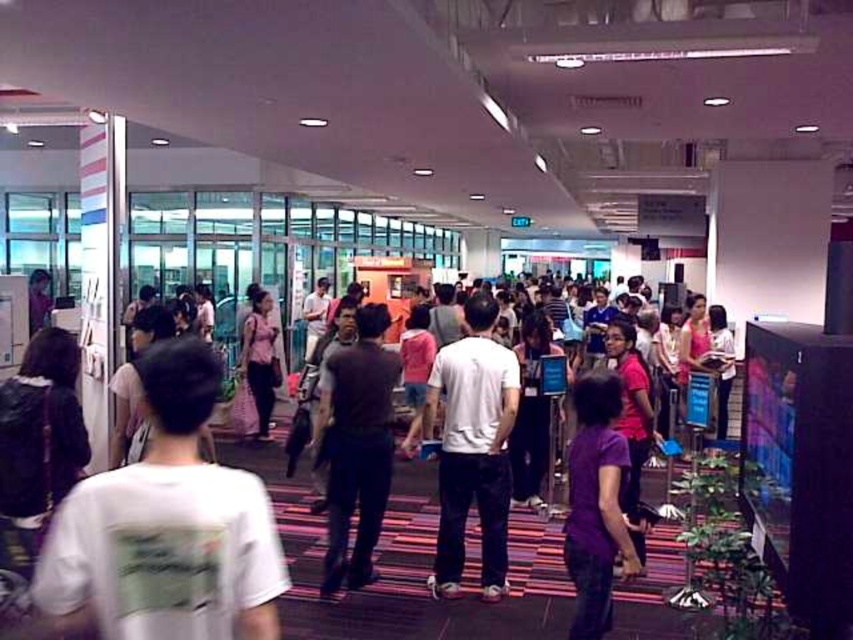
Question: Is white matte shirt at center wider than dark brown shirt at center?

Choices:
 (A) yes
 (B) no

Answer: (A)

Question: Which object is closer to the camera taking this photo?

Choices:
 (A) white cotton t-shirt at center
 (B) dark brown shirt at center
 (C) white matte shirt at center

Answer: (A)

Question: Based on their relative distances, which object is nearer to the pink fabric dress at center?

Choices:
 (A) white matte shirt at center
 (B) purple matte shirt at center
 (C) white cotton t-shirt at center
 (D) dark brown shirt at center

Answer: (D)

Question: Where is white cotton t-shirt at center located in relation to dark brown shirt at center in the image?

Choices:
 (A) above
 (B) below

Answer: (A)

Question: Which of the following is the closest to the observer?

Choices:
 (A) dark brown shirt at center
 (B) white matte shirt at center
 (C) pink fabric dress at center
 (D) white cotton t-shirt at center

Answer: (D)

Question: Can you confirm if white cotton t-shirt at center is positioned above white matte shirt at center?

Choices:
 (A) yes
 (B) no

Answer: (A)